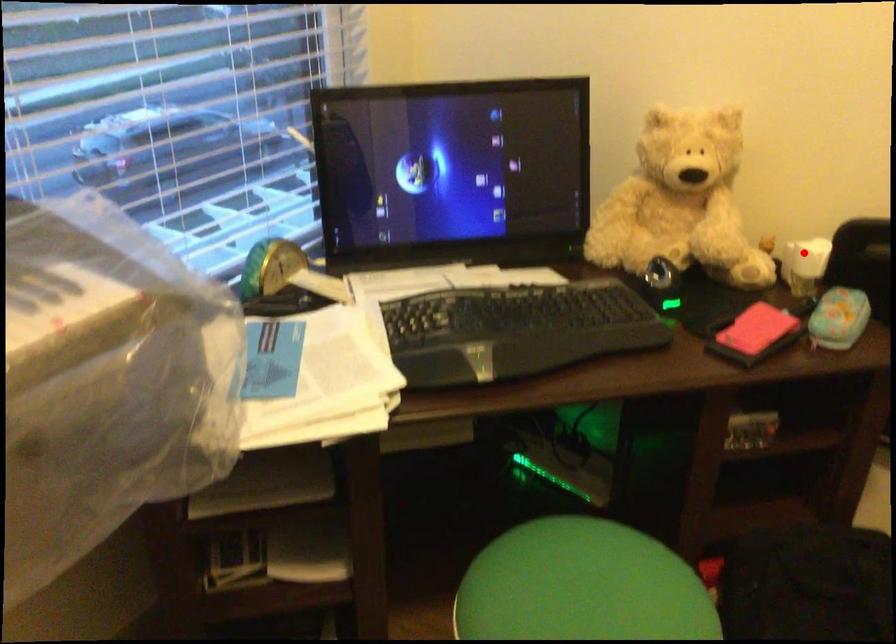
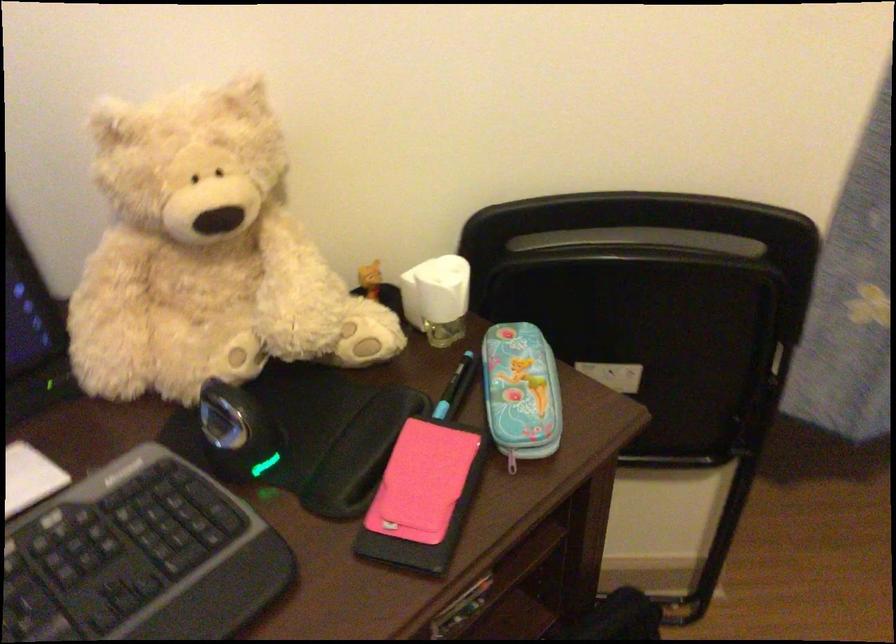
In the second image, find the point that corresponds to the highlighted location in the first image.

(437, 298)